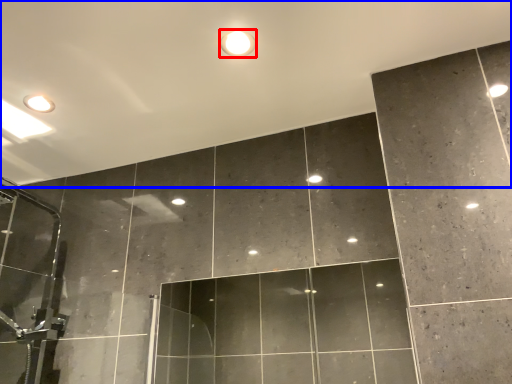
Question: Which object is further to the camera taking this photo, droplight (highlighted by a red box) or backdrop (highlighted by a blue box)?

Choices:
 (A) droplight
 (B) backdrop

Answer: (A)